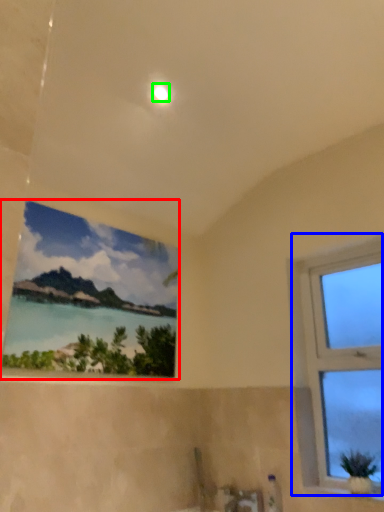
Question: Which object is positioned closest to window (highlighted by a red box)? Select from window (highlighted by a blue box) and light (highlighted by a green box).

Choices:
 (A) window
 (B) light

Answer: (A)